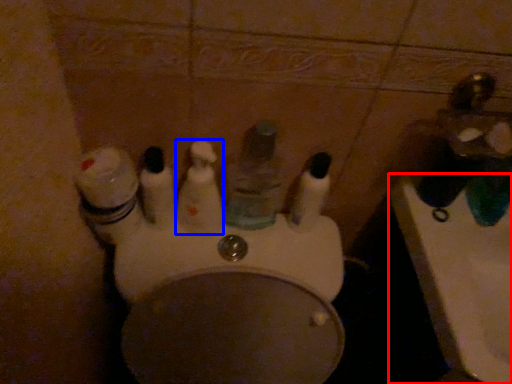
Question: Which point is closer to the camera, sink (highlighted by a red box) or mouthwash (highlighted by a blue box)?

Choices:
 (A) sink
 (B) mouthwash

Answer: (A)